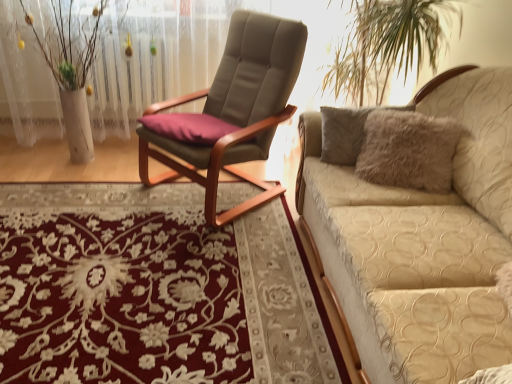
You are a GUI agent. You are given a task and a screenshot of the screen. Output one action in this format:
    pyautogui.click(x=<x>, y=<y>)
    Task: Click on the beige quilted couch at right
    The height and width of the screenshot is (384, 512).
    Given the screenshot: What is the action you would take?
    pyautogui.click(x=420, y=242)

Where is `suede-like beige chair at center`? This screenshot has height=384, width=512. suede-like beige chair at center is located at coordinates (236, 109).

What do you see at coordinates (236, 109) in the screenshot? The width and height of the screenshot is (512, 384). I see `suede-like beige chair at center` at bounding box center [236, 109].

You are a GUI agent. You are given a task and a screenshot of the screen. Output one action in this format:
    pyautogui.click(x=<x>, y=<y>)
    Task: Click on the floral carpet at center
    The height and width of the screenshot is (384, 512).
    Given the screenshot: What is the action you would take?
    point(152,290)

In terms of width, does floral carpet at center look wider or thinner when compared to white textured vase at left?

floral carpet at center is wider than white textured vase at left.

From the image's perspective, is floral carpet at center below white textured vase at left?

Yes, from the image's perspective, floral carpet at center is below white textured vase at left.

Which is more to the left, floral carpet at center or white textured vase at left?

white textured vase at left is more to the left.

Is floral carpet at center facing towards white textured vase at left?

No, floral carpet at center is not facing towards white textured vase at left.

Is floral carpet at center taller or shorter than beige quilted couch at right?

floral carpet at center is shorter than beige quilted couch at right.

Is floral carpet at center inside the boundaries of beige quilted couch at right, or outside?

floral carpet at center is not inside beige quilted couch at right, it's outside.

Would you say floral carpet at center is a long distance from beige quilted couch at right?

floral carpet at center is actually quite close to beige quilted couch at right.

Which is closer, (228, 341) or (464, 68)?

Point (228, 341)

Is suede-like beige chair at center facing away from beige quilted couch at right?

No, suede-like beige chair at center is not facing the opposite direction of beige quilted couch at right.

Measure the distance between suede-like beige chair at center and beige quilted couch at right.

A distance of 71.23 centimeters exists between suede-like beige chair at center and beige quilted couch at right.

From a real-world perspective, is suede-like beige chair at center physically below beige quilted couch at right?

No, from a real-world perspective, suede-like beige chair at center is not under beige quilted couch at right.

Are suede-like beige chair at center and beige quilted couch at right making contact?

No, suede-like beige chair at center is not touching beige quilted couch at right.

Is point (340, 168) positioned before point (214, 217)?

Yes, it is.

Considering the positions of objects beige quilted couch at right and suede-like beige chair at center in the image provided, who is more to the left, beige quilted couch at right or suede-like beige chair at center?

suede-like beige chair at center is more to the left.

Consider the image. Considering the sizes of beige quilted couch at right and suede-like beige chair at center in the image, is beige quilted couch at right bigger or smaller than suede-like beige chair at center?

In the image, beige quilted couch at right appears to be larger than suede-like beige chair at center.

Find the location of a particular element. The width and height of the screenshot is (512, 384). chair behind the beige quilted couch at right is located at coordinates (236, 109).

Is suede-like beige chair at center turned away from white textured vase at left?

suede-like beige chair at center does not have its back to white textured vase at left.

Based on the photo, is suede-like beige chair at center in contact with white textured vase at left?

They are not placed beside each other.

From the image's perspective, does suede-like beige chair at center appear lower than white textured vase at left?

Yes.

Identify the location of floral arrangement on the left of suede-like beige chair at center. (71, 66).

In the scene shown: Is there a large distance between beige quilted couch at right and floral carpet at center?

That's not correct — beige quilted couch at right is a little close to floral carpet at center.

This screenshot has width=512, height=384. Find the location of `studio couch lying in front of the floral carpet at center`. studio couch lying in front of the floral carpet at center is located at coordinates (420, 242).

Could you tell me if beige quilted couch at right is turned towards floral carpet at center?

Yes, beige quilted couch at right is aimed at floral carpet at center.

Based on the photo, does beige quilted couch at right have a greater width compared to floral carpet at center?

No.

Does white textured vase at left lie behind suede-like beige chair at center?

Yes, white textured vase at left is further from the camera.

From the image's perspective, is white textured vase at left on suede-like beige chair at center?

Correct, white textured vase at left appears higher than suede-like beige chair at center in the image.

From the picture: Could you tell me if white textured vase at left is turned towards suede-like beige chair at center?

No, white textured vase at left is not oriented towards suede-like beige chair at center.

Which of these two, white textured vase at left or suede-like beige chair at center, is wider?

With larger width is suede-like beige chair at center.

Locate an element on the screen. mat below the white textured vase at left (from the image's perspective) is located at coordinates (152, 290).

Find the location of `studio couch on the right of floral carpet at center`. studio couch on the right of floral carpet at center is located at coordinates (420, 242).

From the image, which object appears to be nearer to suede-like beige chair at center, floral carpet at center or white textured vase at left?

The object closer to suede-like beige chair at center is floral carpet at center.

Considering their positions, is beige quilted couch at right positioned further to white textured vase at left than floral carpet at center?

beige quilted couch at right is positioned further to the anchor white textured vase at left.

When comparing their distances from beige quilted couch at right, does white textured vase at left or floral carpet at center seem further?

white textured vase at left lies further to beige quilted couch at right than the other object.

From the image, which object appears to be farther from suede-like beige chair at center, beige quilted couch at right or white textured vase at left?

Among the two, white textured vase at left is located further to suede-like beige chair at center.

Based on their spatial positions, is suede-like beige chair at center or floral carpet at center further from white textured vase at left?

The object further to white textured vase at left is floral carpet at center.

Which object lies further to the anchor point suede-like beige chair at center, white textured vase at left or floral carpet at center?

white textured vase at left lies further to suede-like beige chair at center than the other object.

Looking at the image, which one is located closer to floral carpet at center, white textured vase at left or suede-like beige chair at center?

suede-like beige chair at center is closer to floral carpet at center.

Based on their spatial positions, is suede-like beige chair at center or floral carpet at center further from beige quilted couch at right?

The object further to beige quilted couch at right is suede-like beige chair at center.

Find the location of a particular element. The image size is (512, 384). chair between floral carpet at center and beige quilted couch at right in the horizontal direction is located at coordinates (236, 109).

Find the location of a particular element. The width and height of the screenshot is (512, 384). chair between white textured vase at left and beige quilted couch at right is located at coordinates (236, 109).

Where is `chair between white textured vase at left and floral carpet at center vertically`? chair between white textured vase at left and floral carpet at center vertically is located at coordinates (236, 109).

Locate an element on the screen. mat situated between white textured vase at left and beige quilted couch at right from left to right is located at coordinates (152, 290).